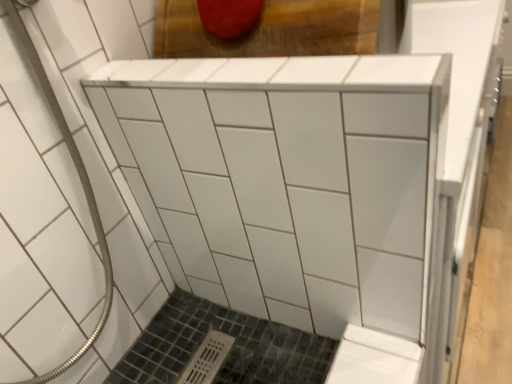
Question: Can you confirm if white glossy cabinet at center is positioned to the left of white glossy tile at center?

Choices:
 (A) no
 (B) yes

Answer: (A)

Question: Is white glossy cabinet at center positioned behind white glossy tile at center?

Choices:
 (A) no
 (B) yes

Answer: (B)

Question: Considering the relative sizes of white glossy cabinet at center and white glossy tile at center in the image provided, is white glossy cabinet at center taller than white glossy tile at center?

Choices:
 (A) no
 (B) yes

Answer: (A)

Question: Is white glossy cabinet at center looking in the opposite direction of white glossy tile at center?

Choices:
 (A) yes
 (B) no

Answer: (B)

Question: From a real-world perspective, is white glossy cabinet at center located beneath white glossy tile at center?

Choices:
 (A) yes
 (B) no

Answer: (A)

Question: Would you say white glossy cabinet at center contains white glossy tile at center?

Choices:
 (A) no
 (B) yes

Answer: (A)

Question: Does white glossy tile at center have a smaller size compared to white glossy cabinet at center?

Choices:
 (A) yes
 (B) no

Answer: (B)

Question: Can you confirm if white glossy tile at center is thinner than white glossy cabinet at center?

Choices:
 (A) yes
 (B) no

Answer: (B)

Question: Considering the relative sizes of white glossy tile at center and white glossy cabinet at center in the image provided, is white glossy tile at center bigger than white glossy cabinet at center?

Choices:
 (A) no
 (B) yes

Answer: (B)

Question: Is white glossy tile at center to the left of white glossy cabinet at center from the viewer's perspective?

Choices:
 (A) yes
 (B) no

Answer: (A)

Question: Can we say white glossy tile at center lies outside white glossy cabinet at center?

Choices:
 (A) yes
 (B) no

Answer: (A)

Question: Considering the relative positions of white glossy tile at center and white glossy cabinet at center in the image provided, is white glossy tile at center to the right of white glossy cabinet at center from the viewer's perspective?

Choices:
 (A) yes
 (B) no

Answer: (B)

Question: Considering the positions of white glossy tile at center and white glossy cabinet at center in the image, is white glossy tile at center bigger or smaller than white glossy cabinet at center?

Choices:
 (A) small
 (B) big

Answer: (B)